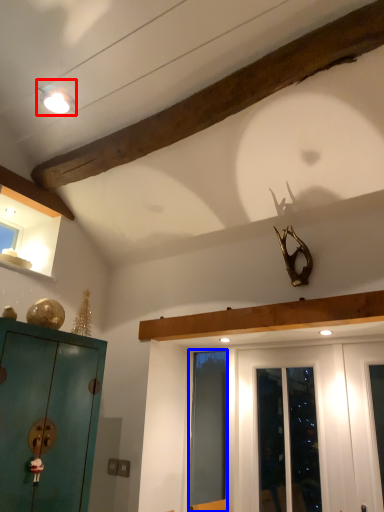
Question: Which object is closer to the camera taking this photo, light fixture (highlighted by a red box) or screen door (highlighted by a blue box)?

Choices:
 (A) light fixture
 (B) screen door

Answer: (A)